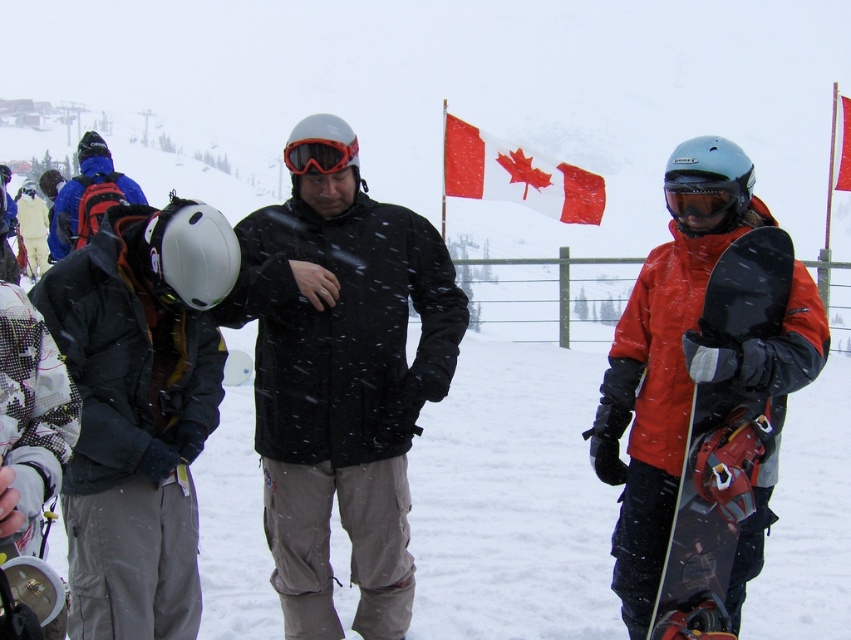
Does matte black jacket at center appear under matte black helmet at left?

Actually, matte black jacket at center is above matte black helmet at left.

The height and width of the screenshot is (640, 851). What do you see at coordinates (341, 387) in the screenshot?
I see `matte black jacket at center` at bounding box center [341, 387].

This screenshot has height=640, width=851. Find the location of `matte black jacket at center`. matte black jacket at center is located at coordinates (341, 387).

Is point (353, 488) farther from camera compared to point (350, 160)?

That is True.

Between matte black jacket at center and orange matte goggles at center, which one appears on the left side from the viewer's perspective?

From the viewer's perspective, orange matte goggles at center appears more on the left side.

Is point (307, 531) positioned after point (347, 164)?

Yes, point (307, 531) is farther from viewer.

The image size is (851, 640). What are the coordinates of `matte black jacket at center` in the screenshot? It's located at (341, 387).

Is point (191, 259) positioned behind point (454, 176)?

No, (191, 259) is in front of (454, 176).

Locate an element on the screen. The height and width of the screenshot is (640, 851). matte black helmet at left is located at coordinates (140, 410).